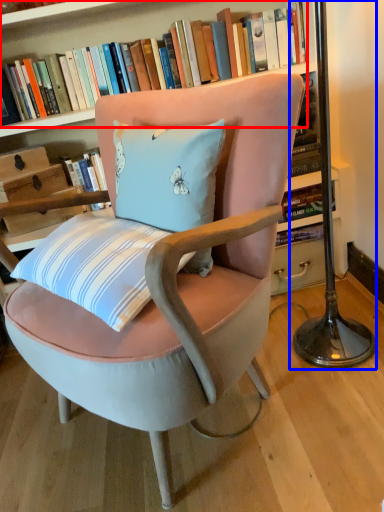
Question: Which of the following is the closest to the observer, book (highlighted by a red box) or table lamp (highlighted by a blue box)?

Choices:
 (A) book
 (B) table lamp

Answer: (B)